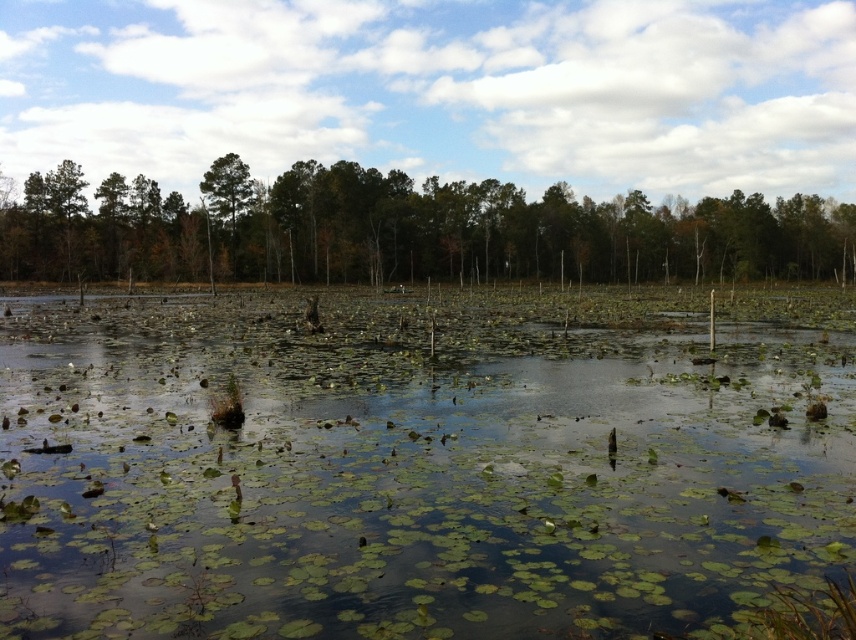
Question: Is green leafy water at center further to camera compared to green leafy trees at center?

Choices:
 (A) no
 (B) yes

Answer: (A)

Question: Which of the following is the closest to the observer?

Choices:
 (A) green leafy trees at center
 (B) green leafy water at center

Answer: (B)

Question: Is green leafy water at center smaller than green leafy trees at center?

Choices:
 (A) no
 (B) yes

Answer: (B)

Question: Which of the following is the closest to the observer?

Choices:
 (A) green leafy trees at center
 (B) green leafy water at center

Answer: (B)

Question: Is green leafy water at center below green leafy trees at center?

Choices:
 (A) yes
 (B) no

Answer: (A)